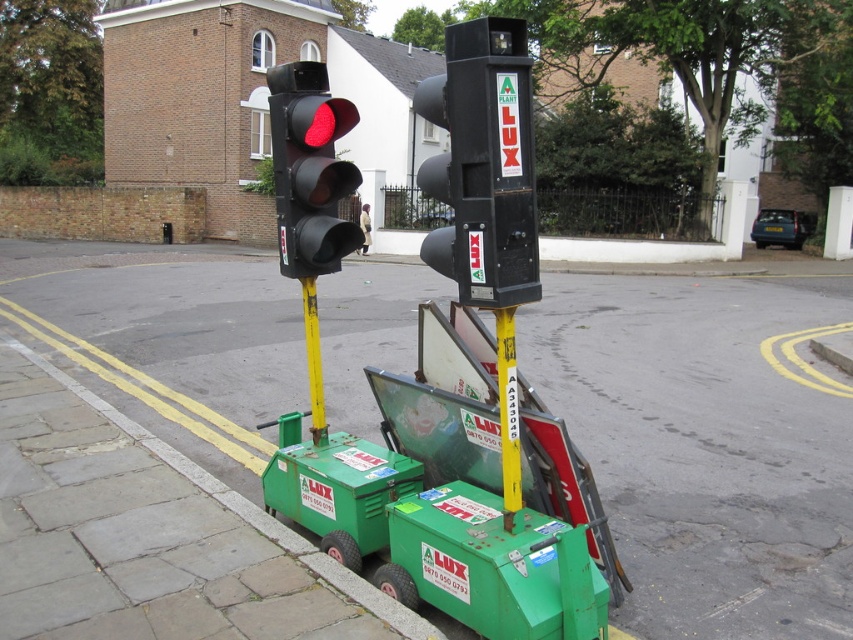
Between black plastic traffic light at center and yellow plastic pole at center, which one appears on the left side from the viewer's perspective?

black plastic traffic light at center is more to the left.

Where is `black plastic traffic light at center`? black plastic traffic light at center is located at coordinates (483, 164).

I want to click on black plastic traffic light at center, so click(483, 164).

Between point (473, 74) and point (302, 460), which one is positioned in front?

Positioned in front is point (473, 74).

Is black plastic traffic light at center shorter than green plastic cart at lower center?

In fact, black plastic traffic light at center may be taller than green plastic cart at lower center.

Where is `black plastic traffic light at center`? The width and height of the screenshot is (853, 640). black plastic traffic light at center is located at coordinates (483, 164).

Is the position of black plastic traffic light at center more distant than that of yellow metallic pole at center?

No, it is in front of yellow metallic pole at center.

Does black plastic traffic light at center have a lesser height compared to yellow metallic pole at center?

Incorrect, black plastic traffic light at center's height does not fall short of yellow metallic pole at center's.

Is point (535, 253) closer to camera compared to point (322, 401)?

Yes, point (535, 253) is closer to viewer.

The image size is (853, 640). In order to click on black plastic traffic light at center in this screenshot , I will do `click(483, 164)`.